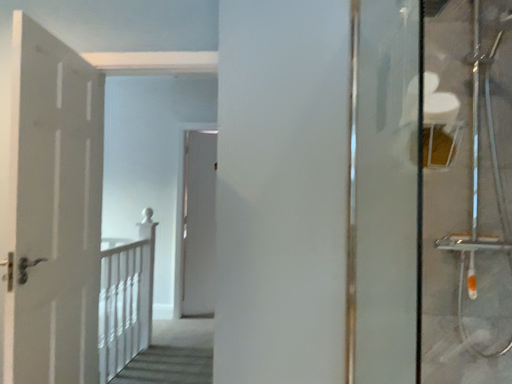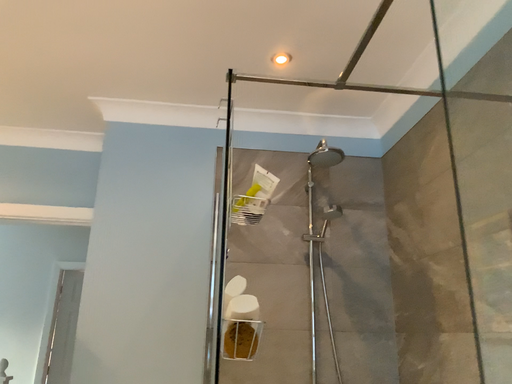
Question: How did the camera likely rotate when shooting the video?

Choices:
 (A) rotated upward
 (B) rotated downward

Answer: (A)